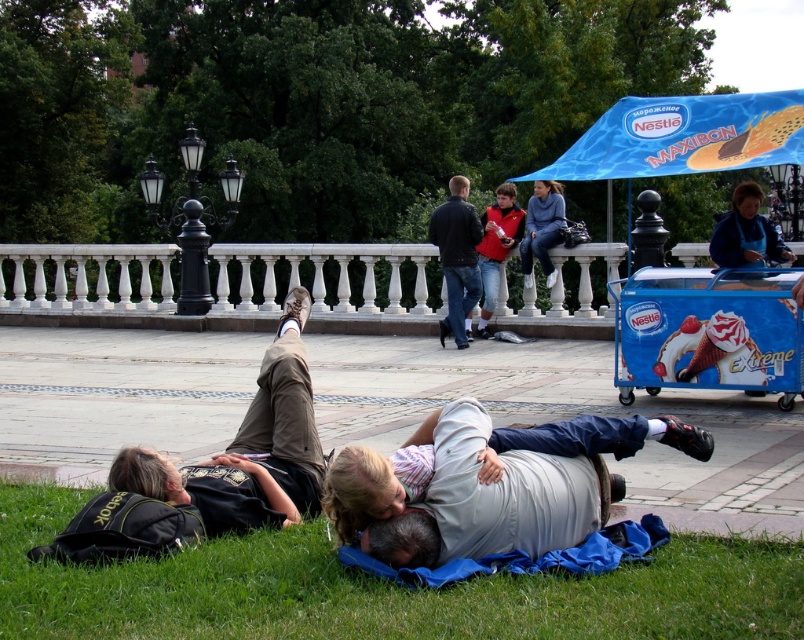
Question: Which point appears closest to the camera in this image?

Choices:
 (A) (472, 237)
 (B) (119, 460)

Answer: (B)

Question: Which point is farther to the camera?

Choices:
 (A) (273, 406)
 (B) (482, 301)
 (C) (770, 349)

Answer: (B)

Question: Does blue plastic cart at lower right appear over dark blue jeans at center?

Choices:
 (A) yes
 (B) no

Answer: (B)

Question: Is blue denim jacket at upper right behind red jacket at center?

Choices:
 (A) yes
 (B) no

Answer: (B)

Question: Which object is farther from the camera taking this photo?

Choices:
 (A) blue cotton sweater at center
 (B) blue denim jacket at upper right
 (C) green grass at lower center
 (D) red jacket at center

Answer: (A)

Question: Can you confirm if light brown hair at lower center is positioned to the right of dark blue jeans at center?

Choices:
 (A) yes
 (B) no

Answer: (B)